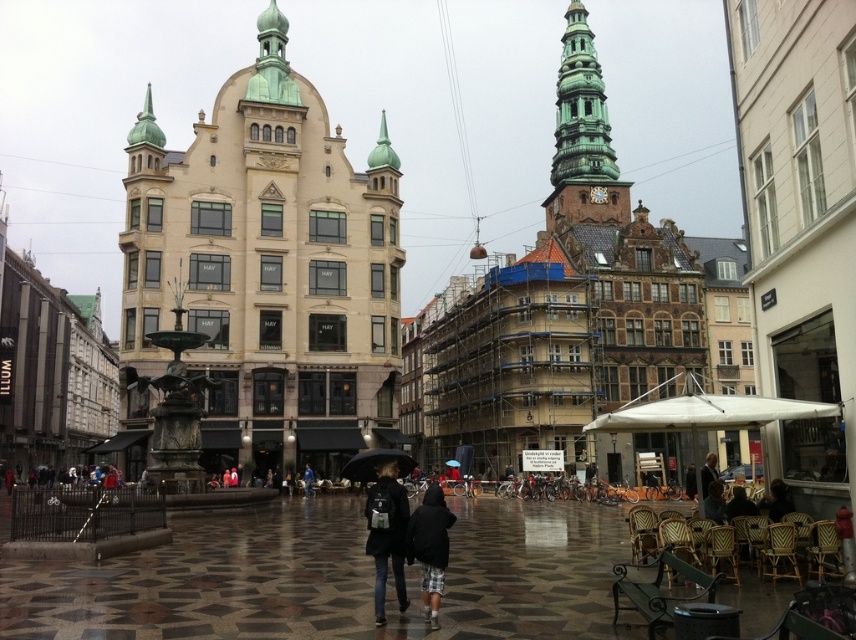
You are standing in the urban square and want to locate the green copper tower at upper center. Which direction should you look relative to the matte black backpack at center?

The green copper tower at upper center is located to the right of the matte black backpack at center.

You are a pedestrian carrying a dark gray backpack at center and a black matte umbrella at center. You want to walk forward. Which item will hit the ground first if you drop both at the same time?

The dark gray backpack at center will hit the ground first because it is in front of the black matte umbrella at center, so it will land before the umbrella when dropped.